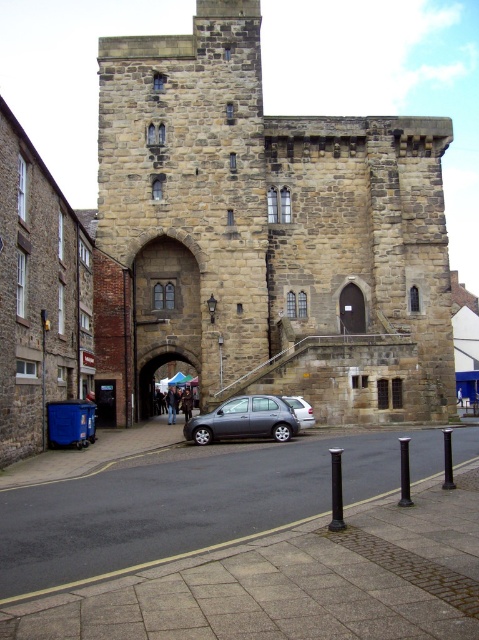
You are standing in the town square and see the satin silver car at center and the white fabric umbrella at center. Which object is closer to you?

The satin silver car at center is closer to you because it is in front of the white fabric umbrella at center.

You are standing at the base of the historic stone tower and notice both the blue plastic trash can at lower left and the white fabric umbrella at center. Which object is closer to you?

The blue plastic trash can at lower left is closer to you because it is in front of the white fabric umbrella at center.

You are standing at the center of the town square and see a satin silver car at center and a white fabric umbrella at center. Which object is closer to you?

Result: Both the satin silver car at center and the white fabric umbrella at center are at the same central position, so they are equally close to you.